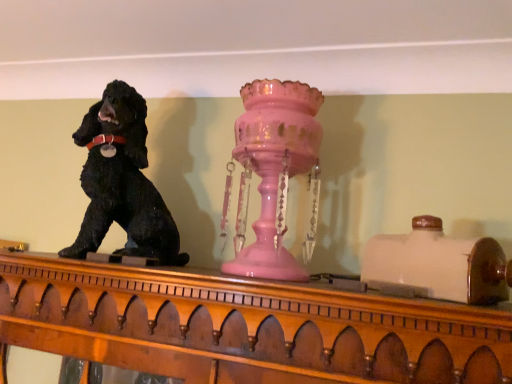
Where is `pink glass candle holder at center`? pink glass candle holder at center is located at coordinates (274, 166).

What do you see at coordinates (274, 166) in the screenshot? I see `pink glass candle holder at center` at bounding box center [274, 166].

Find the location of a particular element. black matte dog at left is located at coordinates (122, 182).

Describe the element at coordinates (122, 182) in the screenshot. I see `black matte dog at left` at that location.

At what (x,y) coordinates should I click in order to perform the action: click on pink glass candle holder at center. Please return your answer as a coordinate pair (x, y). The width and height of the screenshot is (512, 384). Looking at the image, I should click on (274, 166).

Is black matte dog at left to the left of pink glass candle holder at center from the viewer's perspective?

Yes, black matte dog at left is to the left of pink glass candle holder at center.

Between black matte dog at left and pink glass candle holder at center, which one is positioned behind?

black matte dog at left is further away from the camera.

Between point (131, 113) and point (273, 260), which one is positioned in front?

The point (273, 260) is closer.

From the image's perspective, which one is positioned lower, black matte dog at left or pink glass candle holder at center?

pink glass candle holder at center.

From a real-world perspective, is black matte dog at left physically above pink glass candle holder at center?

No.

Is black matte dog at left wider than pink glass candle holder at center?

Yes, black matte dog at left is wider than pink glass candle holder at center.

Looking at this image, considering the sizes of objects black matte dog at left and pink glass candle holder at center in the image provided, who is shorter, black matte dog at left or pink glass candle holder at center?

Standing shorter between the two is black matte dog at left.

In terms of size, does black matte dog at left appear bigger or smaller than pink glass candle holder at center?

In the image, black matte dog at left appears to be larger than pink glass candle holder at center.

Can we say black matte dog at left lies outside pink glass candle holder at center?

Indeed, black matte dog at left is completely outside pink glass candle holder at center.

Is the surface of black matte dog at left in direct contact with pink glass candle holder at center?

No, black matte dog at left is not beside pink glass candle holder at center.

Could you tell me if black matte dog at left is turned towards pink glass candle holder at center?

No, black matte dog at left is not facing towards pink glass candle holder at center.

In the scene shown: How different are the orientations of black matte dog at left and pink glass candle holder at center in degrees?

black matte dog at left and pink glass candle holder at center are facing 0.121 degrees away from each other.

Measure the distance from black matte dog at left to pink glass candle holder at center.

black matte dog at left and pink glass candle holder at center are 10.04 inches apart from each other.

Where is `candle holder in front of the black matte dog at left`? candle holder in front of the black matte dog at left is located at coordinates (274, 166).

Which object is positioned more to the left, pink glass candle holder at center or black matte dog at left?

From the viewer's perspective, black matte dog at left appears more on the left side.

Considering the relative positions of pink glass candle holder at center and black matte dog at left in the image provided, is pink glass candle holder at center behind black matte dog at left?

No, it is not.

Is point (239, 212) closer or farther from the camera than point (104, 233)?

Point (239, 212) is farther from the camera than point (104, 233).

From the image's perspective, is pink glass candle holder at center located above or below black matte dog at left?

Based on their image positions, pink glass candle holder at center is located beneath black matte dog at left.

From a real-world perspective, is pink glass candle holder at center beneath black matte dog at left?

No, from a real-world perspective, pink glass candle holder at center is not under black matte dog at left.

Which of these two, pink glass candle holder at center or black matte dog at left, is wider?

black matte dog at left.

Considering the sizes of objects pink glass candle holder at center and black matte dog at left in the image provided, who is taller, pink glass candle holder at center or black matte dog at left?

With more height is pink glass candle holder at center.

Considering the sizes of objects pink glass candle holder at center and black matte dog at left in the image provided, who is smaller, pink glass candle holder at center or black matte dog at left?

pink glass candle holder at center.

Is black matte dog at left located within pink glass candle holder at center?

No.

Is pink glass candle holder at center next to black matte dog at left and touching it?

No, pink glass candle holder at center is not touching black matte dog at left.

Is pink glass candle holder at center positioned with its back to black matte dog at left?

No, pink glass candle holder at center's orientation is not away from black matte dog at left.

What's the angular difference between pink glass candle holder at center and black matte dog at left's facing directions?

0.121 degrees.

Locate an element on the screen. This screenshot has width=512, height=384. candle holder above the black matte dog at left (from a real-world perspective) is located at coordinates (274, 166).

Find the location of a particular element. This screenshot has width=512, height=384. dog on the left of pink glass candle holder at center is located at coordinates (122, 182).

You are a GUI agent. You are given a task and a screenshot of the screen. Output one action in this format:
    pyautogui.click(x=<x>, y=<y>)
    Task: Click on the dog located behind the pink glass candle holder at center
    The width and height of the screenshot is (512, 384).
    Given the screenshot: What is the action you would take?
    pyautogui.click(x=122, y=182)